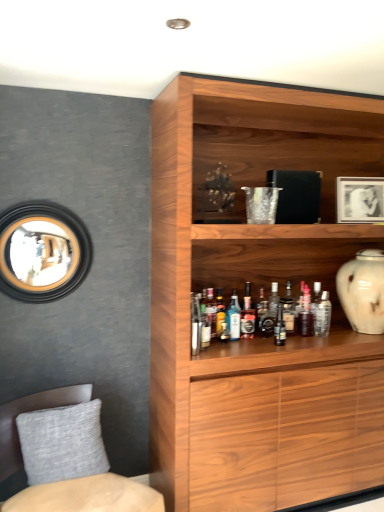
Question: Would you say textured gray cushion at lower left is a long distance from clear glass bottle at shelf center, which is counted as the 9th bottle, starting from the left?

Choices:
 (A) no
 (B) yes

Answer: (B)

Question: Is clear glass bottle at shelf center, which is counted as the 9th bottle, starting from the left, inside textured gray cushion at lower left?

Choices:
 (A) yes
 (B) no

Answer: (B)

Question: Can you confirm if textured gray cushion at lower left is positioned to the left of clear glass bottle at shelf center, marked as the first bottle in a right-to-left arrangement?

Choices:
 (A) yes
 (B) no

Answer: (A)

Question: From a real-world perspective, is textured gray cushion at lower left positioned over clear glass bottle at shelf center, marked as the first bottle in a right-to-left arrangement, based on gravity?

Choices:
 (A) no
 (B) yes

Answer: (A)

Question: From the image's perspective, is textured gray cushion at lower left beneath clear glass bottle at shelf center, which is counted as the 9th bottle, starting from the left?

Choices:
 (A) yes
 (B) no

Answer: (A)

Question: Would you say gray fabric pillow at lower left is to the left or to the right of blue glass bottle at center, which is the 7th bottle from right to left, in the picture?

Choices:
 (A) left
 (B) right

Answer: (A)

Question: Is gray fabric pillow at lower left in front of or behind blue glass bottle at center, acting as the third bottle starting from the left, in the image?

Choices:
 (A) behind
 (B) front

Answer: (B)

Question: Is gray fabric pillow at lower left bigger or smaller than blue glass bottle at center, acting as the third bottle starting from the left?

Choices:
 (A) small
 (B) big

Answer: (B)

Question: Would you say gray fabric pillow at lower left is inside or outside blue glass bottle at center, which is the 7th bottle from right to left?

Choices:
 (A) inside
 (B) outside

Answer: (B)

Question: Would you say translucent glass bottle at center, positioned as the 2th bottle in right-to-left order, is to the left or to the right of white glossy vase at right in the picture?

Choices:
 (A) left
 (B) right

Answer: (A)

Question: From the image's perspective, relative to white glossy vase at right, is translucent glass bottle at center, marked as the 8th bottle in a left-to-right arrangement, above or below?

Choices:
 (A) below
 (B) above

Answer: (A)

Question: In terms of width, does translucent glass bottle at center, positioned as the 2th bottle in right-to-left order, look wider or thinner when compared to white glossy vase at right?

Choices:
 (A) thin
 (B) wide

Answer: (A)

Question: Is translucent glass bottle at center, marked as the 8th bottle in a left-to-right arrangement, taller or shorter than white glossy vase at right?

Choices:
 (A) tall
 (B) short

Answer: (B)

Question: Would you say translucent glass bottle at shelf center, positioned as the sixth bottle in right-to-left order, is to the left or to the right of translucent glass bottle at center, placed as the 1th bottle when sorted from left to right, in the picture?

Choices:
 (A) left
 (B) right

Answer: (B)

Question: Is translucent glass bottle at shelf center, positioned as the sixth bottle in right-to-left order, situated inside translucent glass bottle at center, the ninth bottle when ordered from right to left, or outside?

Choices:
 (A) inside
 (B) outside

Answer: (B)